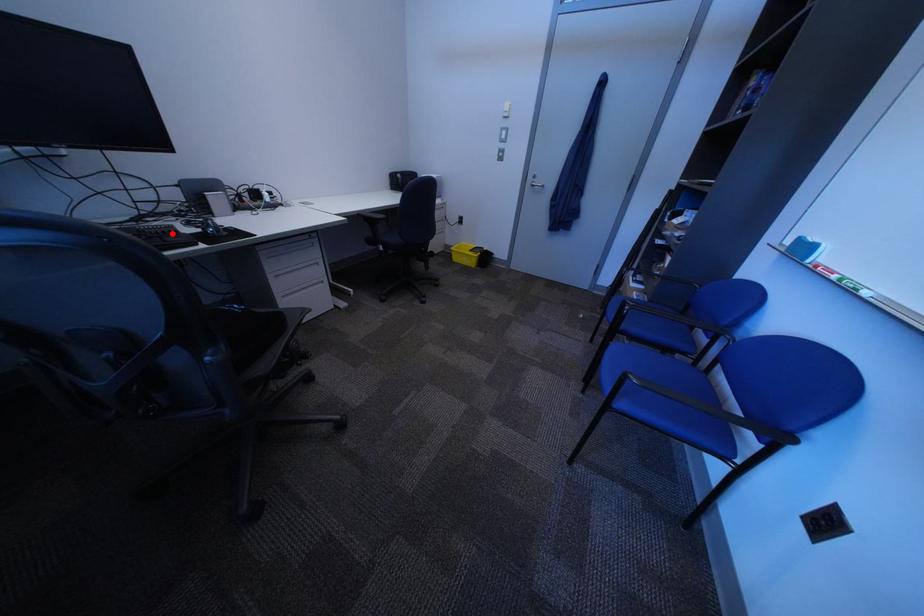
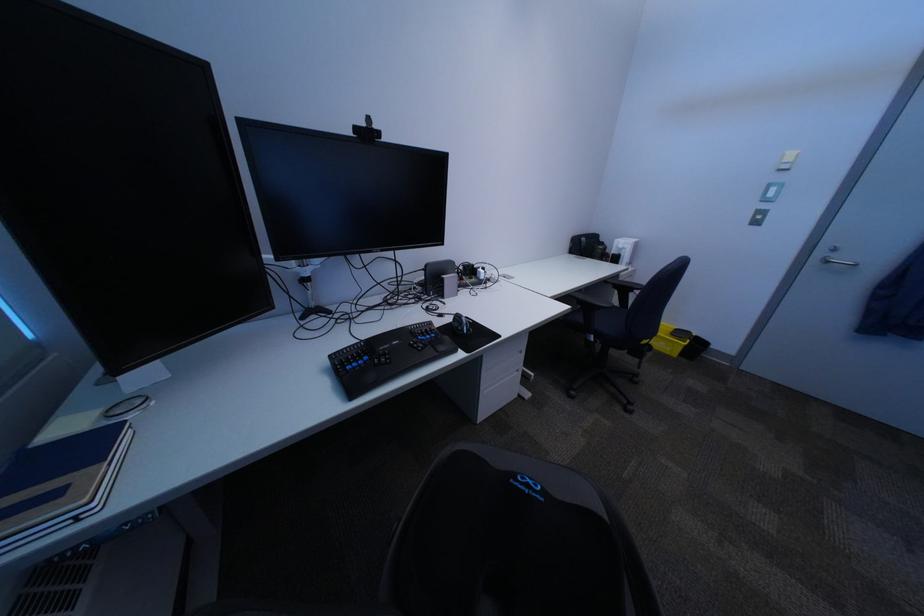
The point at the highlighted location is marked in the first image. Where is the corresponding point in the second image?

(436, 333)